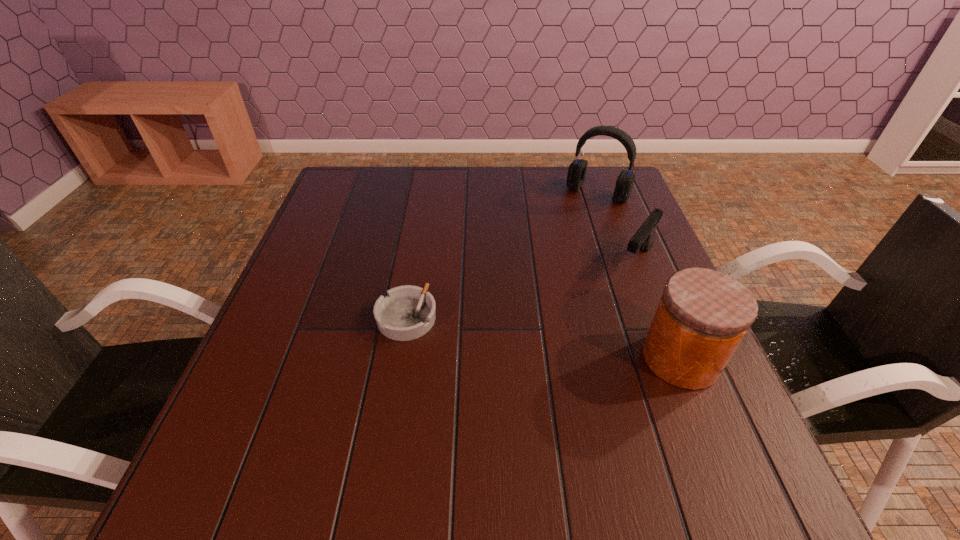
This screenshot has height=540, width=960. What are the coordinates of `vacant space located on the front-facing side of the second farthest object` in the screenshot? It's located at (612, 300).

The width and height of the screenshot is (960, 540). I want to click on blank area located 0.310m on the headband of the farthest object, so click(x=542, y=267).

Identify the location of free region located on the headband of the farthest object. Image resolution: width=960 pixels, height=540 pixels. (573, 224).

The image size is (960, 540). I want to click on vacant space located 0.260m on the headband of the farthest object, so click(x=550, y=256).

Identify the location of object located at the far edge. Image resolution: width=960 pixels, height=540 pixels. (577, 169).

Image resolution: width=960 pixels, height=540 pixels. I want to click on jar that is at the right edge, so click(703, 315).

Identify the location of pistol at the right edge. (643, 239).

Where is `headset that is at the right edge`? The width and height of the screenshot is (960, 540). headset that is at the right edge is located at coordinates click(577, 169).

The width and height of the screenshot is (960, 540). I want to click on object that is at the far right corner, so tap(577, 169).

Locate an element on the screen. The width and height of the screenshot is (960, 540). vacant space at the far edge of the desktop is located at coordinates (515, 195).